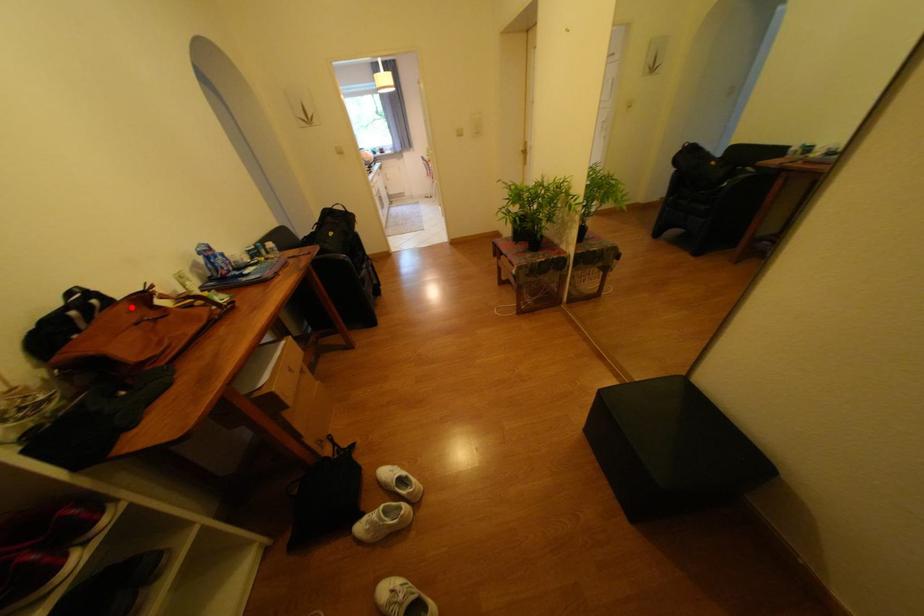
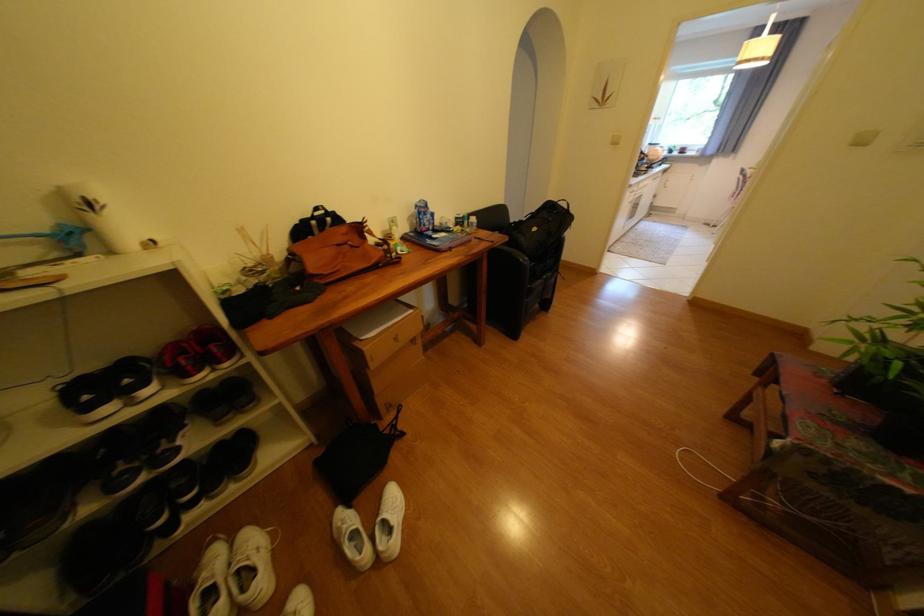
Question: I am providing you with two images of the same scene from different viewpoints. A red point is shown in image1. For the corresponding object point in image2, is it positioned nearer or farther from the camera?

Choices:
 (A) Nearer
 (B) Farther

Answer: (A)